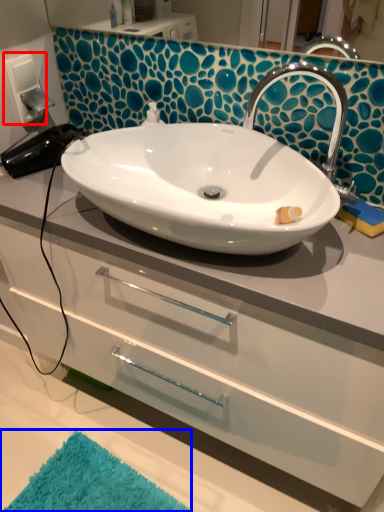
Question: Among these objects, which one is nearest to the camera, electric outlet (highlighted by a red box) or bath mat (highlighted by a blue box)?

Choices:
 (A) electric outlet
 (B) bath mat

Answer: (B)